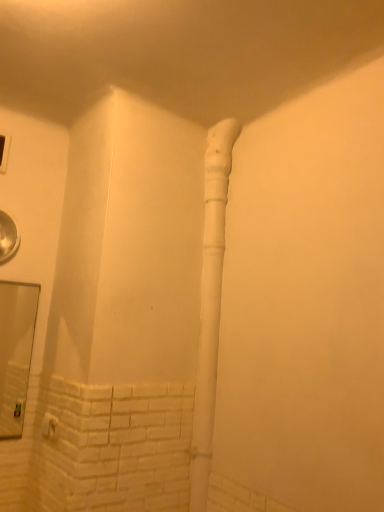
Question: Considering the positions of clear glass mirror at lower left and white matte water pipe at center in the image, is clear glass mirror at lower left taller or shorter than white matte water pipe at center?

Choices:
 (A) short
 (B) tall

Answer: (A)

Question: Is point (18, 337) positioned closer to the camera than point (208, 174)?

Choices:
 (A) closer
 (B) farther

Answer: (B)

Question: Considering their positions, is clear glass mirror at lower left located in front of or behind white matte water pipe at center?

Choices:
 (A) behind
 (B) front

Answer: (A)

Question: Is white matte water pipe at center taller or shorter than clear glass mirror at lower left?

Choices:
 (A) tall
 (B) short

Answer: (A)

Question: From a real-world perspective, is white matte water pipe at center above or below clear glass mirror at lower left?

Choices:
 (A) below
 (B) above

Answer: (B)

Question: In the image, is white matte water pipe at center on the left side or the right side of clear glass mirror at lower left?

Choices:
 (A) right
 (B) left

Answer: (A)

Question: From the image's perspective, is white matte water pipe at center positioned above or below clear glass mirror at lower left?

Choices:
 (A) below
 (B) above

Answer: (B)